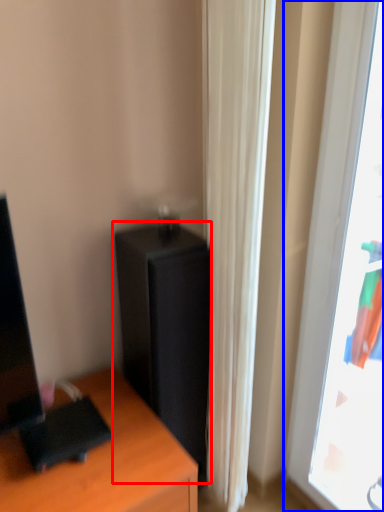
Question: Which object is closer to the camera taking this photo, file cabinet (highlighted by a red box) or window (highlighted by a blue box)?

Choices:
 (A) file cabinet
 (B) window

Answer: (B)